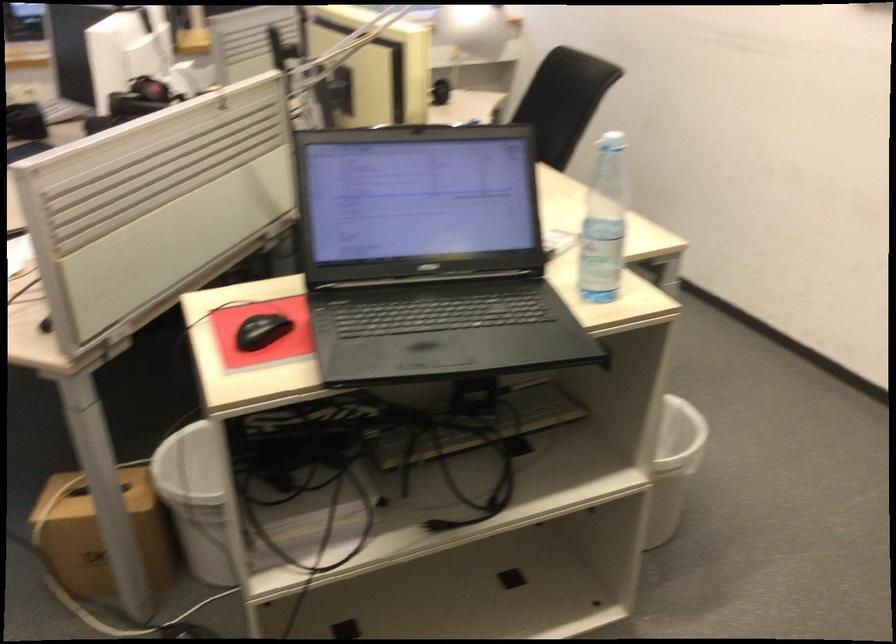
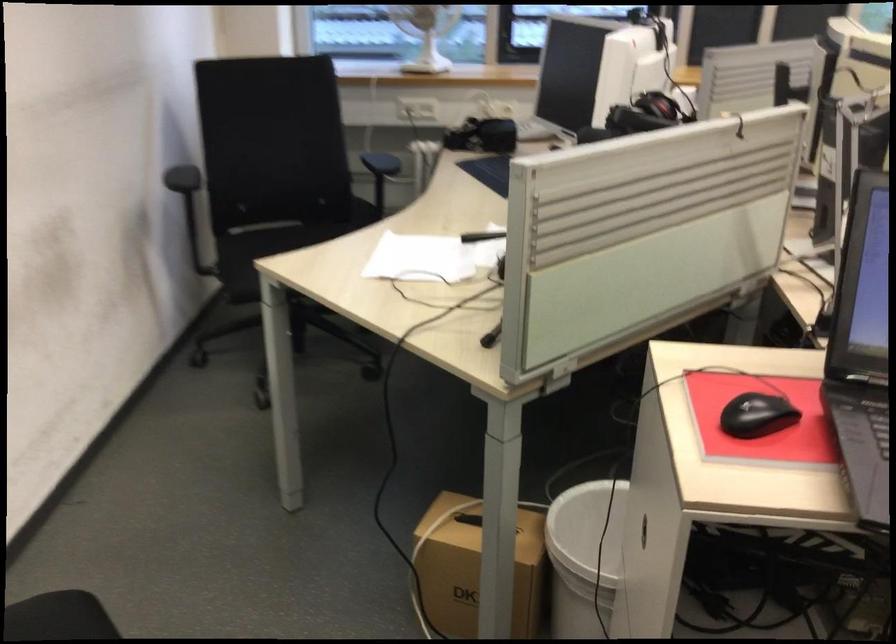
In the second image, find the point that corresponds to point (104, 529) in the first image.

(474, 567)